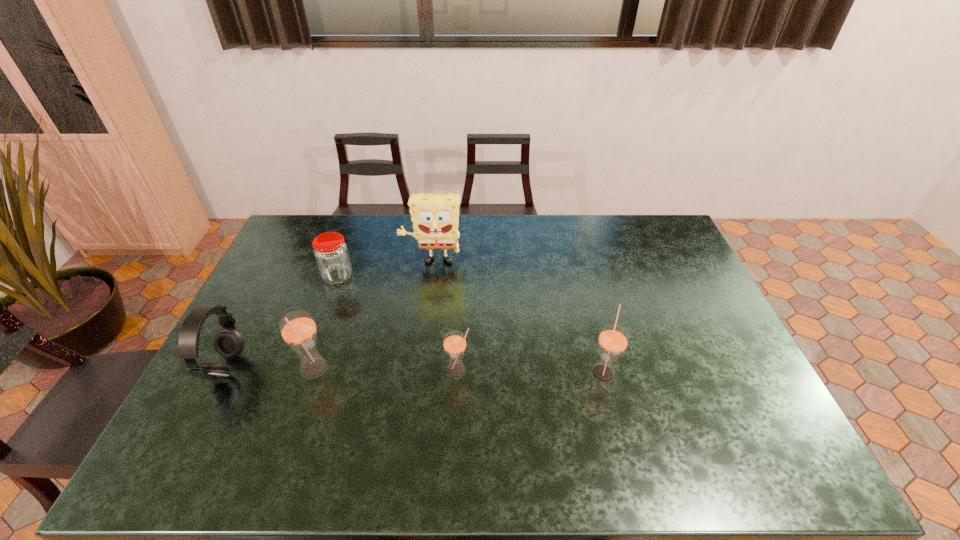
Given the evenly spaced straws in the image, where should an extra straw be added on the right to preserve the spacing? Please point to a vacant space. Please provide its 2D coordinates. Your answer should be formatted as a tuple, i.e. [(x, y)], where the tuple contains the x and y coordinates of a point satisfying the conditions above.

[(748, 373)]